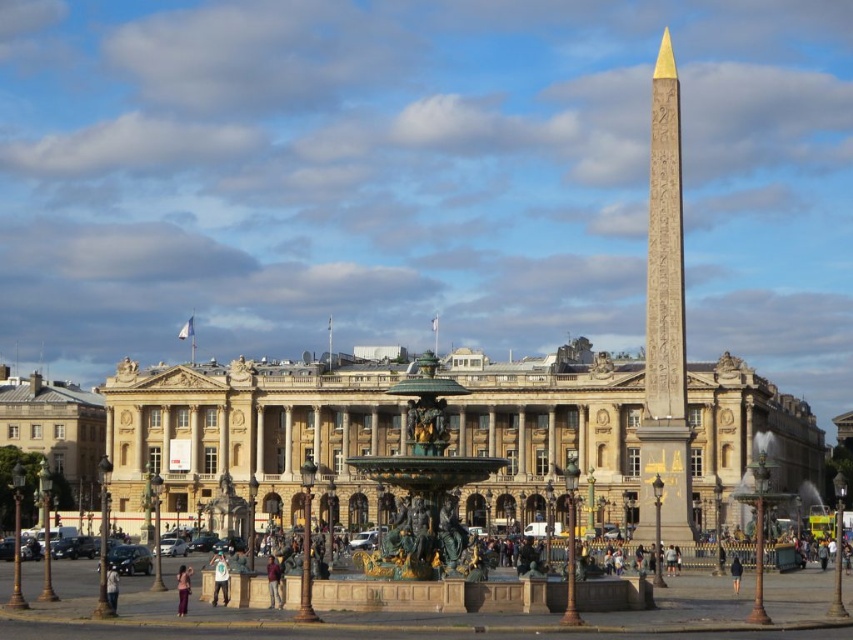
You are a tourist standing in the urban square and want to take a photo of the golden stone palace at center and the white cotton shirt at center. Which object should you focus on first if you want to capture both in a single frame without moving the camera?

You should focus on the golden stone palace at center first because it is taller than the white cotton shirt at center, so it will occupy more space in the frame and ensure both are visible without needing to adjust the camera position.